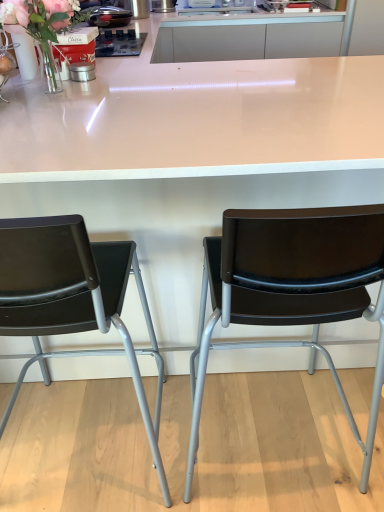
Question: Is glossy metallic waffle maker at upper center, the second appliance when ordered from front to back, thinner than white glossy table at center?

Choices:
 (A) no
 (B) yes

Answer: (B)

Question: From the image's perspective, is glossy metallic waffle maker at upper center, which is the second appliance from bottom to top, above white glossy table at center?

Choices:
 (A) yes
 (B) no

Answer: (A)

Question: Is the depth of glossy metallic waffle maker at upper center, acting as the first appliance starting from the left, less than that of white glossy table at center?

Choices:
 (A) no
 (B) yes

Answer: (A)

Question: Is glossy metallic waffle maker at upper center, the second appliance when ordered from front to back, beside white glossy table at center?

Choices:
 (A) yes
 (B) no

Answer: (B)

Question: Is glossy metallic waffle maker at upper center, which is the second appliance from bottom to top, positioned beyond the bounds of white glossy table at center?

Choices:
 (A) no
 (B) yes

Answer: (B)

Question: From a real-world perspective, is glossy metallic waffle maker at upper center, arranged as the 2th appliance when viewed from the back, over white glossy table at center?

Choices:
 (A) no
 (B) yes

Answer: (B)

Question: Is metallic tin at upper left, marked as the first appliance in a front-to-back arrangement, aimed at translucent glass vase at upper left?

Choices:
 (A) yes
 (B) no

Answer: (B)

Question: Is metallic tin at upper left, the second appliance viewed from the left, not near translucent glass vase at upper left?

Choices:
 (A) yes
 (B) no

Answer: (B)

Question: Is metallic tin at upper left, marked as the first appliance in a front-to-back arrangement, at the left side of translucent glass vase at upper left?

Choices:
 (A) no
 (B) yes

Answer: (A)

Question: Does metallic tin at upper left, marked as the third appliance in a top-to-bottom arrangement, appear on the right side of translucent glass vase at upper left?

Choices:
 (A) yes
 (B) no

Answer: (A)

Question: Is metallic tin at upper left, marked as the third appliance in a top-to-bottom arrangement, not inside translucent glass vase at upper left?

Choices:
 (A) no
 (B) yes

Answer: (B)

Question: Can you confirm if metallic tin at upper left, marked as the 1th appliance in a bottom-to-top arrangement, is thinner than translucent glass vase at upper left?

Choices:
 (A) yes
 (B) no

Answer: (A)

Question: Does matte black chair at left, the 1th chair from the left, have a lesser width compared to clear glass vase at left?

Choices:
 (A) no
 (B) yes

Answer: (A)